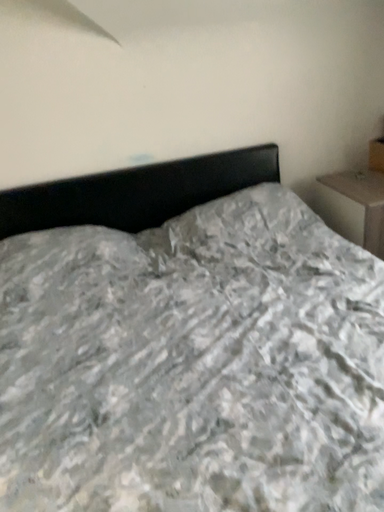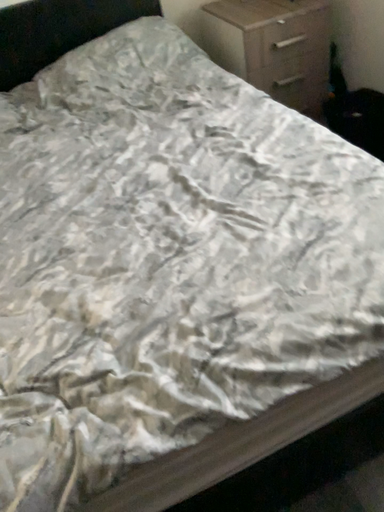
Question: How did the camera likely rotate when shooting the video?

Choices:
 (A) rotated downward
 (B) rotated upward

Answer: (A)